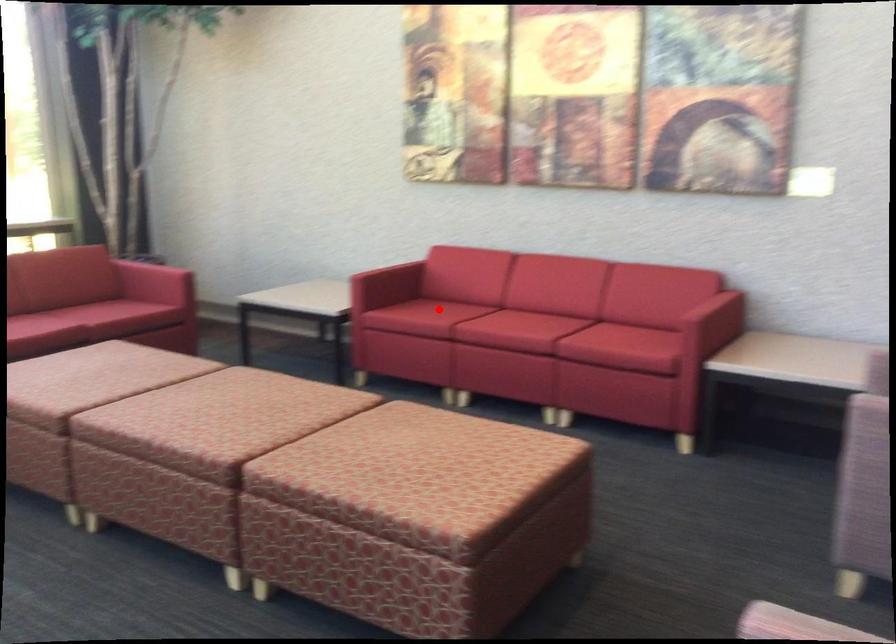
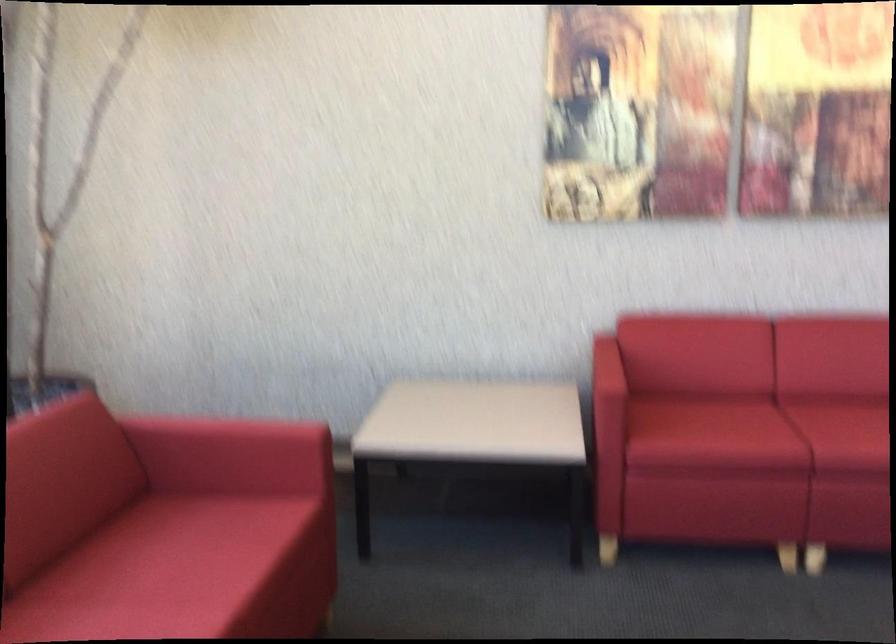
Question: I am providing you with two images of the same scene from different viewpoints. Image1 has a red point marked. In image2, the corresponding 3D location appears at what relative position? Reply with the corresponding letter.

Choices:
 (A) Closer
 (B) Farther

Answer: (A)